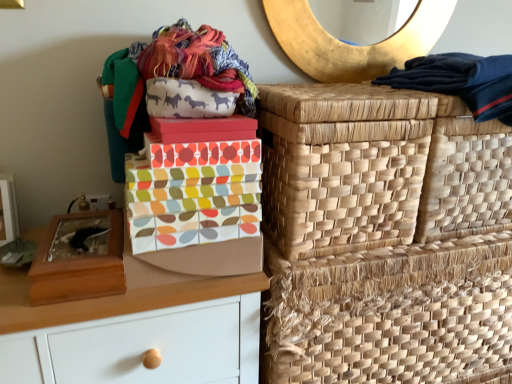
Where is `vacant point above natural woven basket at right, which ranks as the second basket in bottom-to-top order (from a real-world perspective)`? vacant point above natural woven basket at right, which ranks as the second basket in bottom-to-top order (from a real-world perspective) is located at coordinates (326, 92).